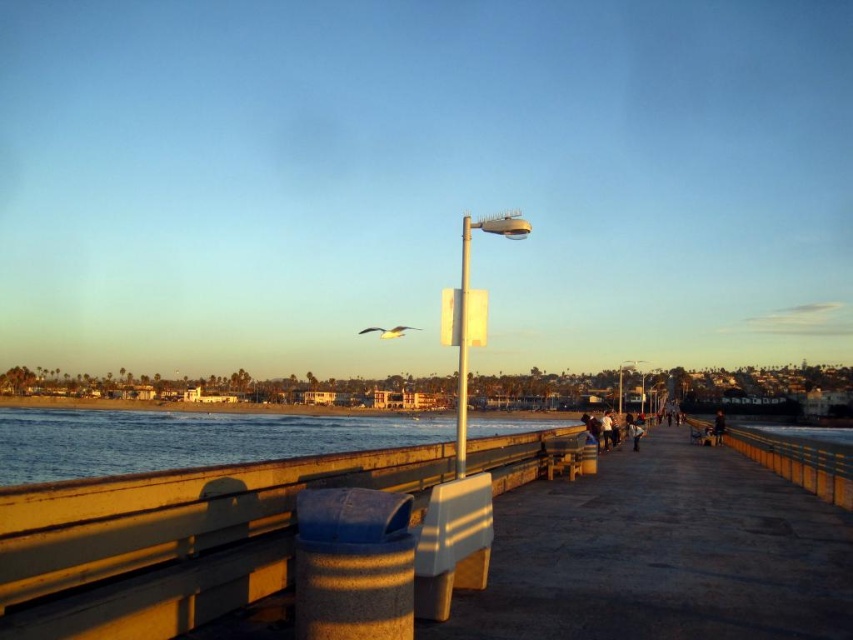
Based on the photo, you are a maintenance worker assigned to check the white plastic pole at center and the dark fabric bag at lower right. Which object requires more space to work around due to its size?

The dark fabric bag at lower right requires more space to work around because it is larger in size than the white plastic pole at center.

You are standing on the pier and want to place a small bench exactly at the location of the smooth concrete rail at lower center. What are the coordinates where you should place the bench?

The coordinates for the smooth concrete rail at lower center are at point (171, 540), so you should place the bench there.

You are standing at the entrance of the pier and want to place a new bench exactly at the center of the pier. The white plastic pole at center is currently in the way. Can you move the pole to the exact center to make space for the bench?

The white plastic pole at center is already located at the exact center coordinates of the pier, so moving it would not be necessary. The bench can be placed there without disturbing the pole.